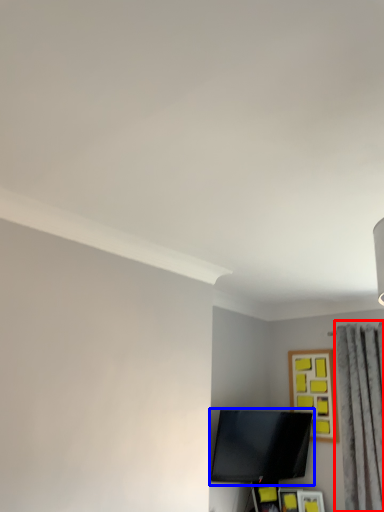
Question: Among these objects, which one is nearest to the camera, curtain (highlighted by a red box) or television (highlighted by a blue box)?

Choices:
 (A) curtain
 (B) television

Answer: (A)